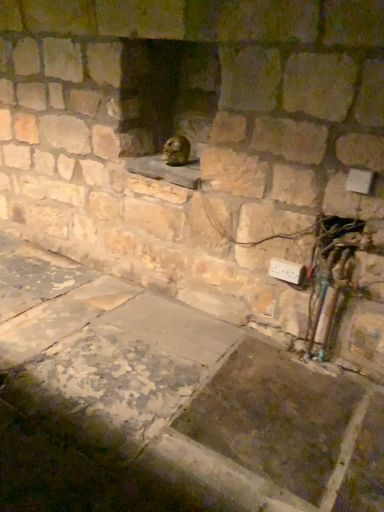
In order to face shiny brown rodent at center, should I rotate leftwards or rightwards?

You should rotate left by 2.342 degrees.

In the scene shown: Measure the distance between shiny brown rodent at center and camera.

shiny brown rodent at center is 2.26 meters away from camera.

Where is `shiny brown rodent at center`? shiny brown rodent at center is located at coordinates (177, 150).

What do you see at coordinates (177, 150) in the screenshot?
I see `shiny brown rodent at center` at bounding box center [177, 150].

Image resolution: width=384 pixels, height=512 pixels. What do you see at coordinates (287, 271) in the screenshot? I see `white plastic electric outlet at lower right` at bounding box center [287, 271].

Find the location of a particular element. This screenshot has width=384, height=512. white plastic electric outlet at lower right is located at coordinates (287, 271).

Identify the location of shiny brown rodent at center. The width and height of the screenshot is (384, 512). (177, 150).

Is shiny brown rodent at center at the right side of white plastic electric outlet at lower right?

Incorrect, shiny brown rodent at center is not on the right side of white plastic electric outlet at lower right.

Which is behind, shiny brown rodent at center or white plastic electric outlet at lower right?

shiny brown rodent at center is behind.

Is point (175, 164) farther from viewer compared to point (295, 285)?

Yes.

From the image's perspective, between shiny brown rodent at center and white plastic electric outlet at lower right, which one is located above?

shiny brown rodent at center.

From a real-world perspective, which is physically below, shiny brown rodent at center or white plastic electric outlet at lower right?

white plastic electric outlet at lower right, from a real-world perspective.

Which of these two, shiny brown rodent at center or white plastic electric outlet at lower right, is wider?

shiny brown rodent at center.

Does shiny brown rodent at center have a lesser height compared to white plastic electric outlet at lower right?

No.

In the scene shown: Is shiny brown rodent at center bigger than white plastic electric outlet at lower right?

Correct, shiny brown rodent at center is larger in size than white plastic electric outlet at lower right.

Do you think shiny brown rodent at center is within white plastic electric outlet at lower right, or outside of it?

shiny brown rodent at center is not inside white plastic electric outlet at lower right, it's outside.

Is shiny brown rodent at center next to white plastic electric outlet at lower right?

There is a gap between shiny brown rodent at center and white plastic electric outlet at lower right.

Is shiny brown rodent at center facing away from white plastic electric outlet at lower right?

No, shiny brown rodent at center's orientation is not away from white plastic electric outlet at lower right.

Can you tell me how much shiny brown rodent at center and white plastic electric outlet at lower right differ in facing direction?

5.74 degrees.

You are a GUI agent. You are given a task and a screenshot of the screen. Output one action in this format:
    pyautogui.click(x=<x>, y=<y>)
    Task: Click on the animal on the left of white plastic electric outlet at lower right
    The image size is (384, 512).
    Given the screenshot: What is the action you would take?
    pyautogui.click(x=177, y=150)

Considering the relative positions of white plastic electric outlet at lower right and shiny brown rodent at center in the image provided, is white plastic electric outlet at lower right to the left or to the right of shiny brown rodent at center?

Clearly, white plastic electric outlet at lower right is on the right of shiny brown rodent at center in the image.

Does white plastic electric outlet at lower right come behind shiny brown rodent at center?

No, white plastic electric outlet at lower right is in front of shiny brown rodent at center.

Is point (275, 268) less distant than point (180, 137)?

Yes, point (275, 268) is in front of point (180, 137).

From the image's perspective, is white plastic electric outlet at lower right beneath shiny brown rodent at center?

Yes, from the image's perspective, white plastic electric outlet at lower right is beneath shiny brown rodent at center.

From a real-world perspective, which is physically below, white plastic electric outlet at lower right or shiny brown rodent at center?

white plastic electric outlet at lower right is physically lower.

Is white plastic electric outlet at lower right wider than shiny brown rodent at center?

Incorrect, the width of white plastic electric outlet at lower right does not surpass that of shiny brown rodent at center.

Based on the photo, considering the relative sizes of white plastic electric outlet at lower right and shiny brown rodent at center in the image provided, is white plastic electric outlet at lower right shorter than shiny brown rodent at center?

→ Yes, white plastic electric outlet at lower right is shorter than shiny brown rodent at center.

Between white plastic electric outlet at lower right and shiny brown rodent at center, which one has larger size?

shiny brown rodent at center is bigger.

Is white plastic electric outlet at lower right completely or partially outside of shiny brown rodent at center?

Yes, white plastic electric outlet at lower right is located beyond the bounds of shiny brown rodent at center.

Is white plastic electric outlet at lower right far from shiny brown rodent at center?

They are positioned close to each other.

Is white plastic electric outlet at lower right turned away from shiny brown rodent at center?

No, white plastic electric outlet at lower right is not facing away from shiny brown rodent at center.

Can you tell me how much white plastic electric outlet at lower right and shiny brown rodent at center differ in facing direction?

5.74 degrees separate the facing orientations of white plastic electric outlet at lower right and shiny brown rodent at center.

In order to click on electric outlet in front of the shiny brown rodent at center in this screenshot , I will do `click(287, 271)`.

I want to click on electric outlet below the shiny brown rodent at center (from the image's perspective), so 287,271.

There is a white plastic electric outlet at lower right. Identify the location of animal above it (from a real-world perspective). (177, 150).